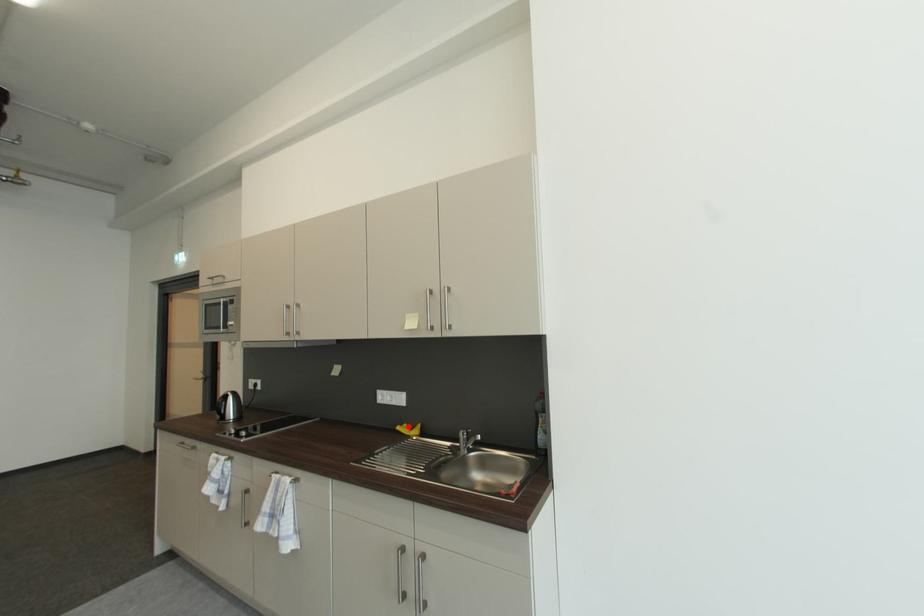
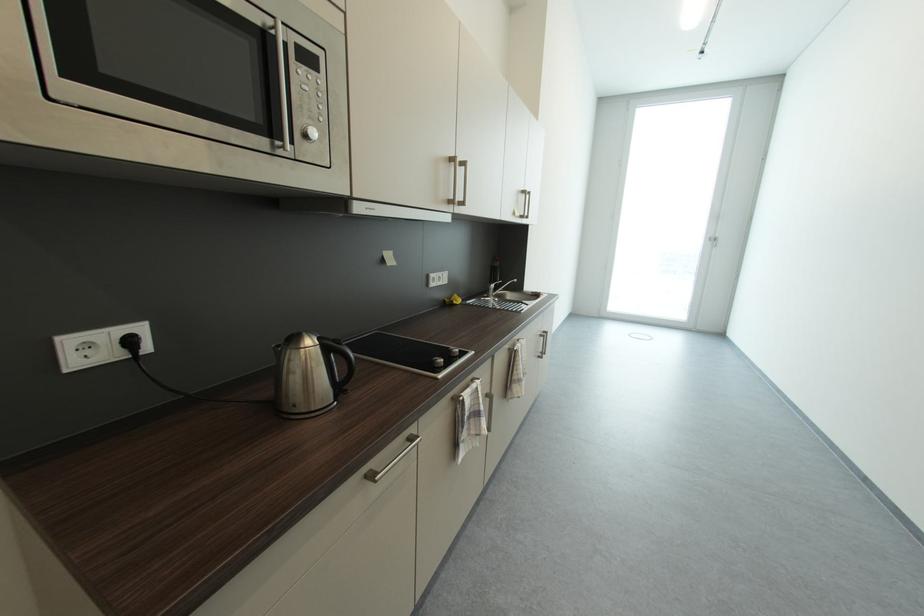
Question: I am providing you with two images of the same scene from different viewpoints. Image1 has a red point marked. In image2, the corresponding 3D location appears at what relative position? Reply with the corresponding letter.

Choices:
 (A) Closer
 (B) Farther

Answer: (A)